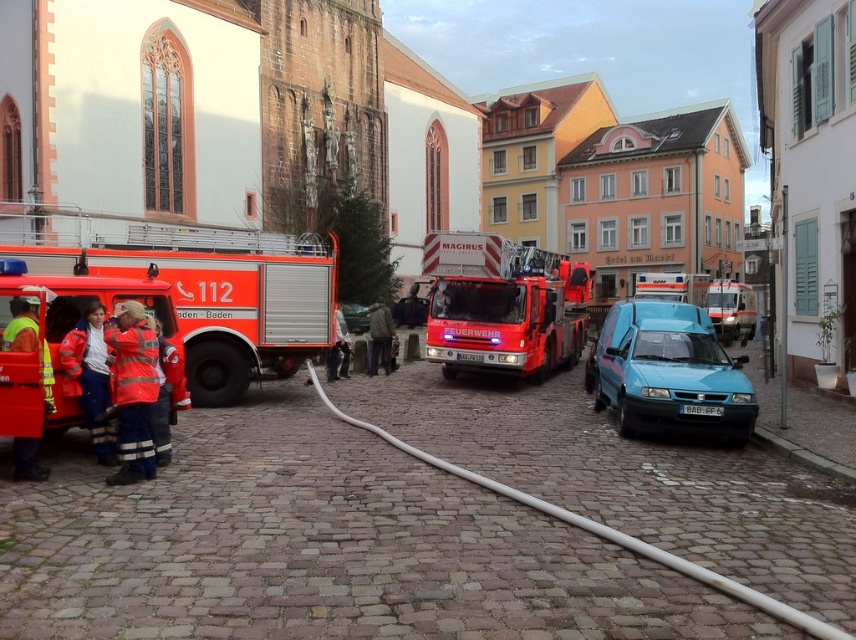
Question: Considering the real-world distances, which object is closest to the orange glossy fire truck at left?

Choices:
 (A) metallic silver car at center
 (B) red glossy fire truck at center
 (C) shiny red fire truck at center

Answer: (A)

Question: Can you confirm if shiny red fire truck at center is bigger than metallic silver fire truck at center?

Choices:
 (A) yes
 (B) no

Answer: (B)

Question: Among these objects, which one is nearest to the camera?

Choices:
 (A) matte red fire truck at left
 (B) metallic silver car at center

Answer: (A)

Question: Among these points, which one is farthest from the camera?

Choices:
 (A) (734, 328)
 (B) (1, 362)

Answer: (A)

Question: Is shiny red fire truck at center above blue matte van at center?

Choices:
 (A) no
 (B) yes

Answer: (B)

Question: Is metallic silver fire truck at center to the right of metallic silver car at center from the viewer's perspective?

Choices:
 (A) yes
 (B) no

Answer: (A)